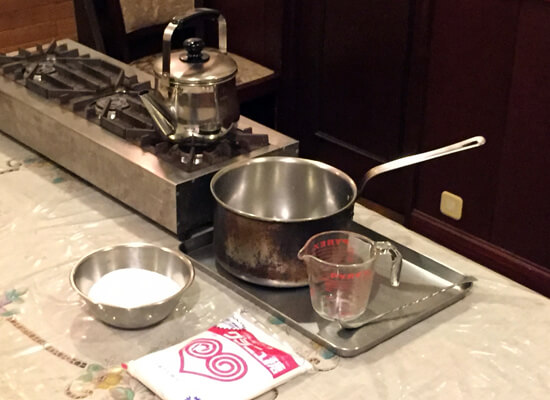
Where is `mixer`? This screenshot has width=550, height=400. mixer is located at coordinates (400, 308).